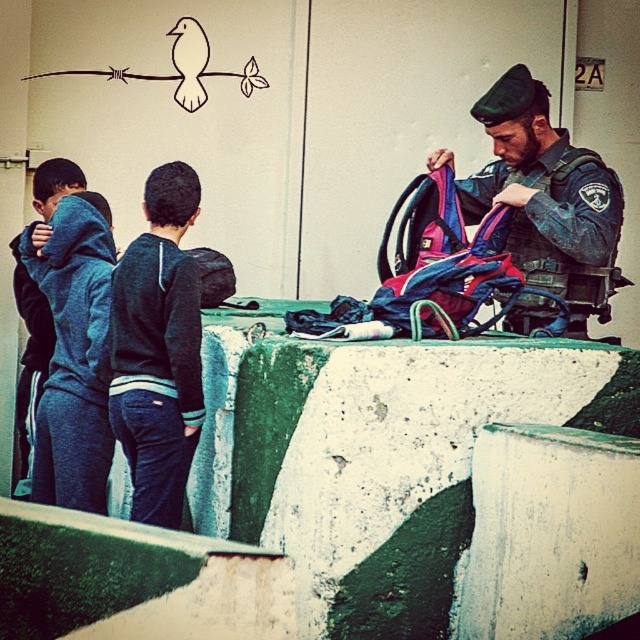
Question: Is dark gray hoodie at center in front of dark blue hoodie at left?

Choices:
 (A) no
 (B) yes

Answer: (B)

Question: Which of the following is the closest to the observer?

Choices:
 (A) (541, 202)
 (B) (100, 390)

Answer: (B)

Question: Does dark gray hoodie at center have a smaller size compared to dark blue hoodie at left?

Choices:
 (A) yes
 (B) no

Answer: (A)

Question: Is dark green uniform at center thinner than dark blue hoodie at left?

Choices:
 (A) yes
 (B) no

Answer: (B)

Question: Which object is closer to the camera taking this photo?

Choices:
 (A) dark gray hoodie at center
 (B) dark blue hoodie at left

Answer: (A)

Question: Which point is closer to the camera?

Choices:
 (A) dark blue hoodie at left
 (B) dark green uniform at center

Answer: (A)